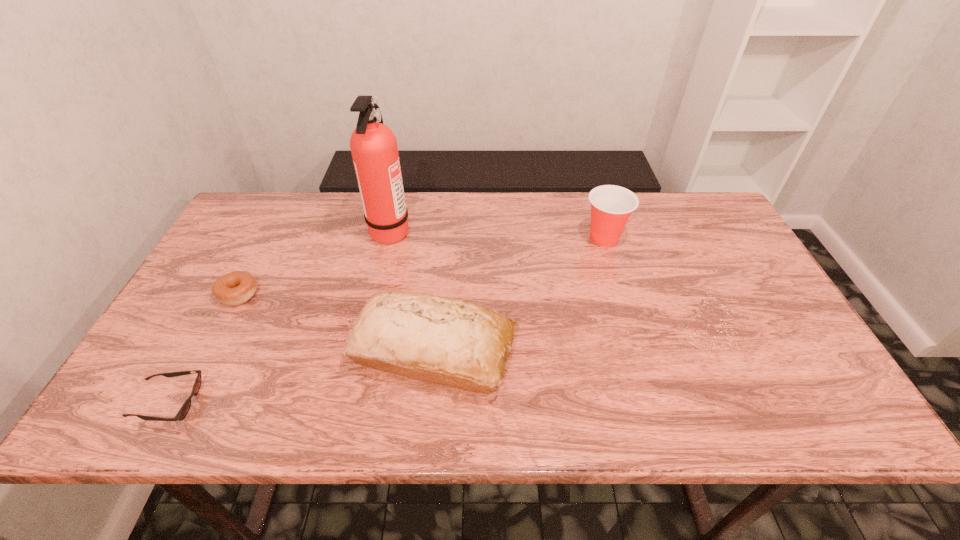
Identify the location of free location at the right edge of the desktop. The image size is (960, 540). (722, 318).

The width and height of the screenshot is (960, 540). In order to click on free point at the far left corner in this screenshot , I will do point(286,217).

Image resolution: width=960 pixels, height=540 pixels. In the image, there is a desktop. What are the coordinates of `free space at the far right corner` in the screenshot? It's located at (719, 235).

Image resolution: width=960 pixels, height=540 pixels. Find the location of `free spot at the near right corner of the desktop`. free spot at the near right corner of the desktop is located at coordinates (837, 410).

Where is `vacant area that lies between the bread and the rightmost object`? This screenshot has width=960, height=540. vacant area that lies between the bread and the rightmost object is located at coordinates (518, 294).

This screenshot has height=540, width=960. I want to click on free space between the bagel and the tallest object, so click(x=315, y=262).

Find the location of a particular element. This screenshot has width=960, height=540. vacant area that lies between the bread and the sunglasses is located at coordinates 301,376.

The width and height of the screenshot is (960, 540). Identify the location of free area in between the bread and the fire extinguisher. pyautogui.click(x=412, y=291).

What are the coordinates of `empty space that is in between the fire extinguisher and the shortest object` in the screenshot? It's located at (279, 316).

Identify the location of vacant space in between the bread and the fire extinguisher. (412, 291).